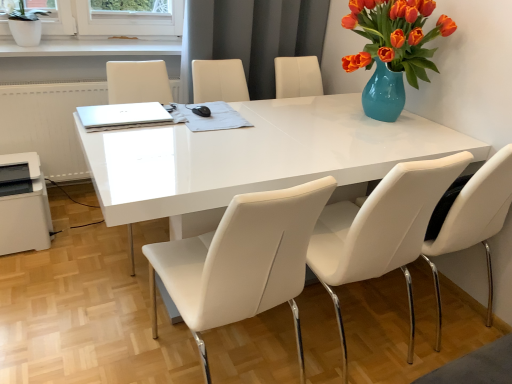
Find the location of `free space that is in between white plastic printer at lower left and white leather chair at center, arranged as the first chair when viewed from the left`. free space that is in between white plastic printer at lower left and white leather chair at center, arranged as the first chair when viewed from the left is located at coordinates (91, 291).